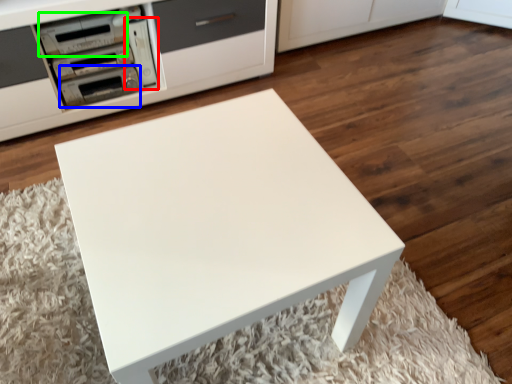
Question: Estimate the real-world distances between objects in this image. Which object is farther from appliance (highlighted by a red box), appliance (highlighted by a blue box) or appliance (highlighted by a green box)?

Choices:
 (A) appliance
 (B) appliance

Answer: (B)